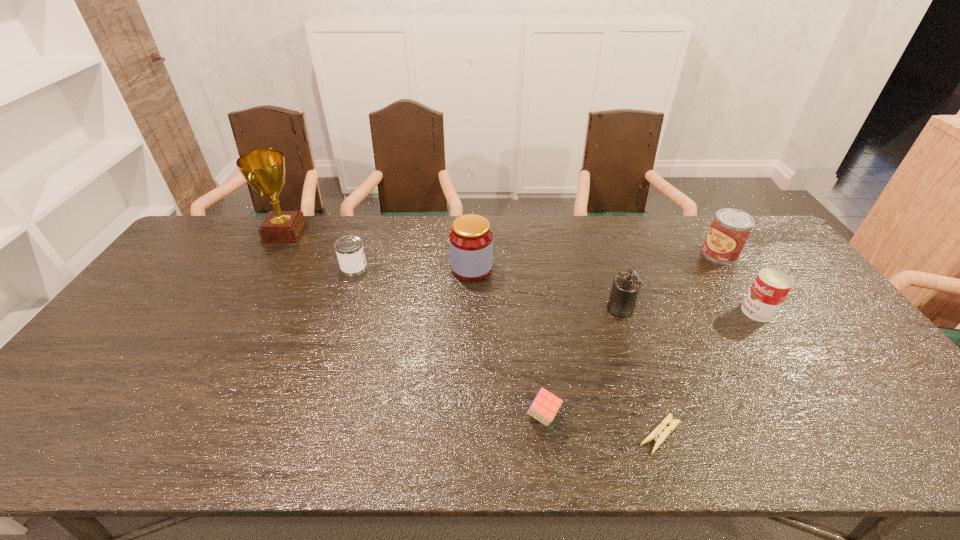
The width and height of the screenshot is (960, 540). What are the coordinates of `free space between the clothespin and the sixth object from right to left` in the screenshot? It's located at (565, 352).

Image resolution: width=960 pixels, height=540 pixels. I want to click on free point between the jar and the second can from left to right, so click(x=546, y=288).

Identify which object is the third closest to the seventh shortest object. Please provide its 2D coordinates. Your answer should be formatted as a tuple, i.e. [(x, y)], where the tuple contains the x and y coordinates of a point satisfying the conditions above.

[(545, 406)]

The width and height of the screenshot is (960, 540). What are the coordinates of `object that stands as the fifth closest to the jar` in the screenshot? It's located at (656, 434).

You are a GUI agent. You are given a task and a screenshot of the screen. Output one action in this format:
    pyautogui.click(x=<x>, y=<y>)
    Task: Click on the can that is the fourth nearest to the leftmost object
    This screenshot has width=960, height=540.
    Given the screenshot: What is the action you would take?
    pyautogui.click(x=770, y=288)

Point out which can is positioned as the third nearest to the fifth object from right to left. Please provide its 2D coordinates. Your answer should be formatted as a tuple, i.e. [(x, y)], where the tuple contains the x and y coordinates of a point satisfying the conditions above.

[(349, 249)]

You are a GUI agent. You are given a task and a screenshot of the screen. Output one action in this format:
    pyautogui.click(x=<x>, y=<y>)
    Task: Click on the free point that satisfies the following two spatial constraints: 1. on the plaque of the award; 2. on the left side of the third can from right to left
    Image resolution: width=960 pixels, height=540 pixels.
    Given the screenshot: What is the action you would take?
    pyautogui.click(x=242, y=308)

At what (x,y) coordinates should I click in order to perform the action: click on vacant space that satisfies the following two spatial constraints: 1. on the plaque of the fourth object from left to right; 2. on the right side of the award. Please return your answer as a coordinate pair (x, y). The height and width of the screenshot is (540, 960). Looking at the image, I should click on (180, 416).

Find the location of a particular element. vacant region that satisfies the following two spatial constraints: 1. on the plaque of the award; 2. on the back side of the seventh tallest object is located at coordinates (180, 416).

Locate an element on the screen. The height and width of the screenshot is (540, 960). vacant space that satisfies the following two spatial constraints: 1. on the front side of the third can from right to left; 2. on the left side of the second tallest object is located at coordinates (470, 308).